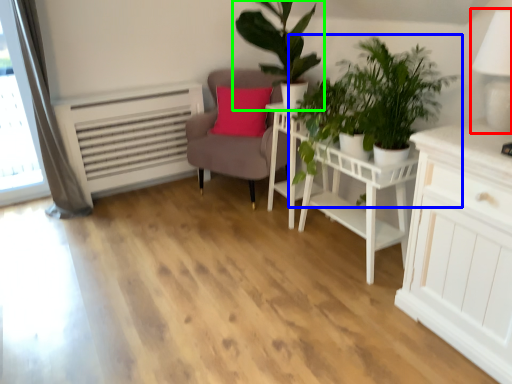
Question: Estimate the real-world distances between objects in this image. Which object is closer to table lamp (highlighted by a red box), houseplant (highlighted by a blue box) or houseplant (highlighted by a green box)?

Choices:
 (A) houseplant
 (B) houseplant

Answer: (A)